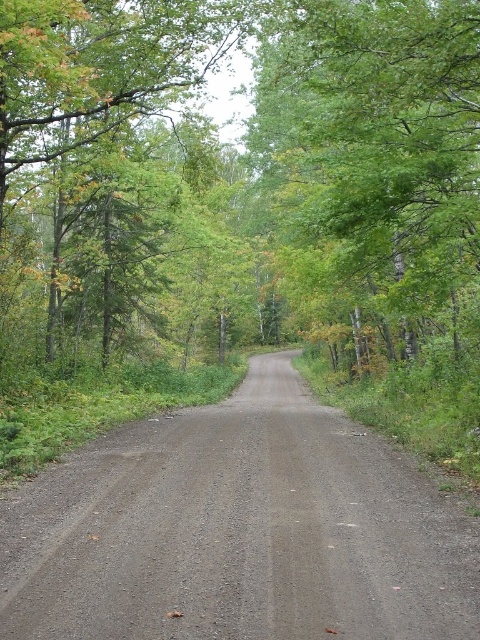
You are standing on the gray gravel road at center and want to walk towards the green leafy tree at center. Which direction should you move relative to the road?

The green leafy tree at center is further to the viewer than the gray gravel road at center, so you should move forward along the gray gravel road at center towards the tree.

You are standing at the starting point of the dirt road in the forest scene. There is a green leafy tree at center. Can you determine the direction of the tree relative to your position?

The green leafy tree at center is located at point coordinates of (240, 163). Since you are at the starting point of the dirt road, the tree is positioned to your left side along the road.